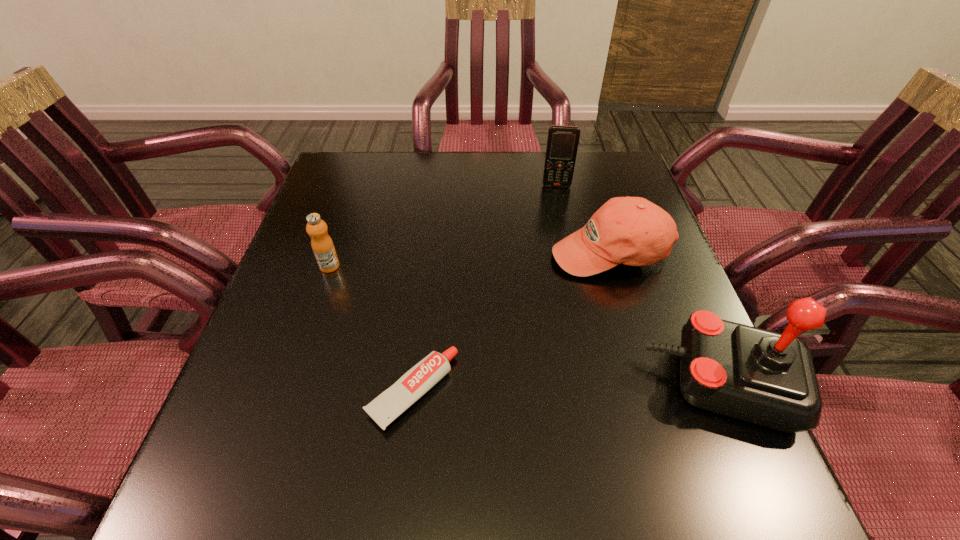
Identify the location of vacant area that lies between the leftmost object and the toothpaste. Image resolution: width=960 pixels, height=540 pixels. (372, 329).

You are a GUI agent. You are given a task and a screenshot of the screen. Output one action in this format:
    pyautogui.click(x=<x>, y=<y>)
    Task: Click on the object that is the second nearest to the joystick
    
    Given the screenshot: What is the action you would take?
    pyautogui.click(x=385, y=408)

Where is `object that is the fourth closest one to the baseball cap`? object that is the fourth closest one to the baseball cap is located at coordinates (322, 245).

Find the location of a particular element. The height and width of the screenshot is (540, 960). blank area in the image that satisfies the following two spatial constraints: 1. on the front side of the tallest object; 2. on the left side of the leftmost object is located at coordinates pyautogui.click(x=290, y=384).

Image resolution: width=960 pixels, height=540 pixels. Identify the location of free point that satisfies the following two spatial constraints: 1. on the front side of the leftmost object; 2. on the left side of the shortest object. (287, 392).

I want to click on blank area in the image that satisfies the following two spatial constraints: 1. on the back side of the joystick; 2. on the right side of the shortest object, so click(414, 384).